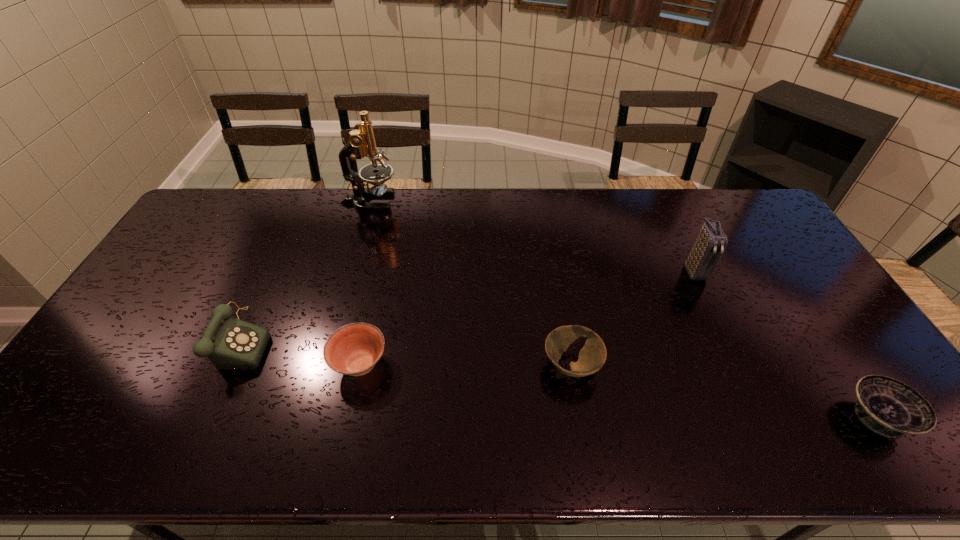
I want to click on the tallest object, so click(361, 143).

Locate an element on the screen. The height and width of the screenshot is (540, 960). microscope is located at coordinates (361, 143).

Locate an element on the screen. The image size is (960, 540). the fifth object from left to right is located at coordinates (711, 242).

This screenshot has height=540, width=960. I want to click on the second farthest object, so click(x=711, y=242).

Find the location of a particular element. The image size is (960, 540). the leftmost object is located at coordinates (230, 343).

At what (x,y) coordinates should I click in order to perform the action: click on the third tallest object. Please return your answer as a coordinate pair (x, y). Looking at the image, I should click on (230, 343).

Where is `the leftmost bowl`? The image size is (960, 540). the leftmost bowl is located at coordinates (354, 349).

This screenshot has height=540, width=960. Identify the location of the third object from right to left. (592, 356).

You are a GUI agent. You are given a task and a screenshot of the screen. Output one action in this format:
    pyautogui.click(x=<x>, y=<y>)
    Task: Click on the rightmost bowl
    The image size is (960, 540).
    Given the screenshot: What is the action you would take?
    pyautogui.click(x=888, y=407)

The image size is (960, 540). In order to click on free space located 0.070m at the eyepiece of the tallest object in this screenshot , I will do `click(418, 201)`.